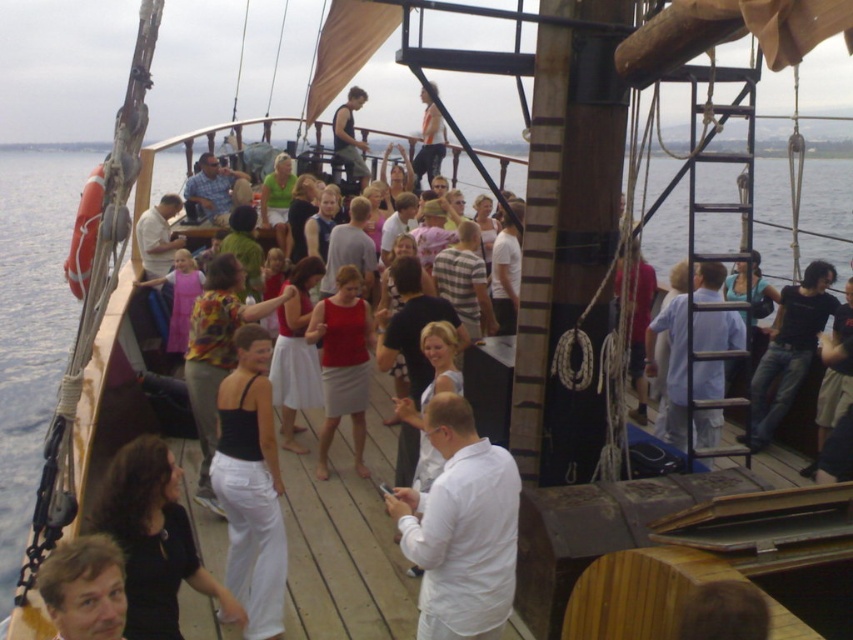
Can you confirm if black matte tank top at center is positioned below dark gray fabric shirt at upper center?

Yes, black matte tank top at center is below dark gray fabric shirt at upper center.

Between black matte tank top at center and dark gray fabric shirt at upper center, which one is positioned lower?

black matte tank top at center

Between point (241, 380) and point (350, 90), which one is positioned in front?

Point (241, 380) is in front.

At what (x,y) coordinates should I click in order to perform the action: click on black matte tank top at center. Please return your answer as a coordinate pair (x, y). Image resolution: width=853 pixels, height=640 pixels. Looking at the image, I should click on 251,486.

Identify the location of matte red tank top at center. (341, 362).

Who is positioned more to the left, matte red tank top at center or dark gray fabric shirt at upper center?

From the viewer's perspective, dark gray fabric shirt at upper center appears more on the left side.

Which is in front, point (341, 388) or point (346, 99)?

Point (341, 388)

What are the coordinates of `matte red tank top at center` in the screenshot? It's located at (341, 362).

Describe the element at coordinates (461, 529) in the screenshot. I see `white matte shirt at center` at that location.

Where is `white matte shirt at center`? white matte shirt at center is located at coordinates (461, 529).